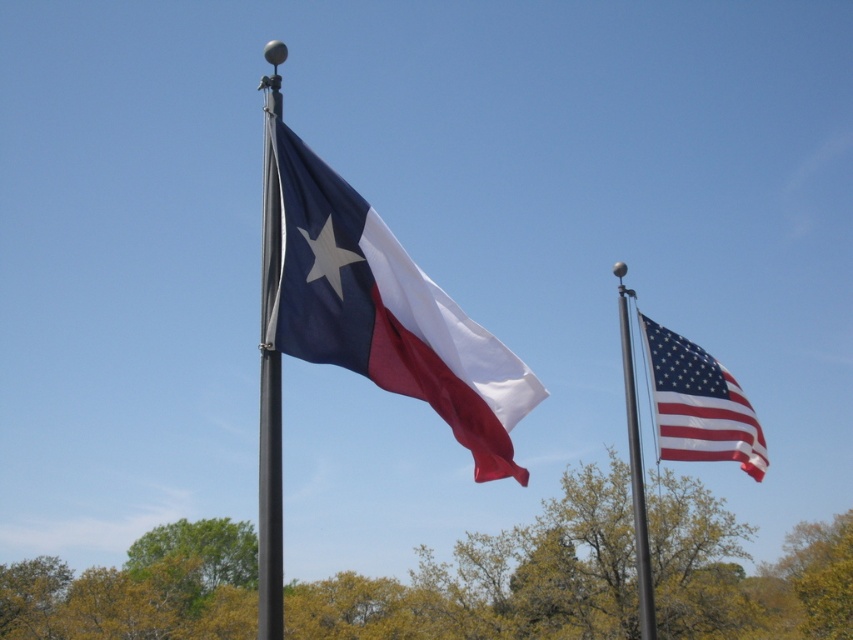
Question: Which of the following is the closest to the observer?

Choices:
 (A) (637, 576)
 (B) (283, 193)
 (C) (683, 364)

Answer: (B)

Question: In this image, where is american flag at right located relative to metallic pole at right?

Choices:
 (A) above
 (B) below

Answer: (A)

Question: Which point is closer to the camera?

Choices:
 (A) (643, 564)
 (B) (480, 451)
 (C) (757, 432)

Answer: (B)

Question: Where is american flag at right located in relation to metallic pole at right in the image?

Choices:
 (A) above
 (B) below

Answer: (A)

Question: Based on their relative distances, which object is farther from the american flag at right?

Choices:
 (A) matte polyester flag at center
 (B) metallic pole at right

Answer: (A)

Question: Does matte polyester flag at center have a larger size compared to metallic pole at right?

Choices:
 (A) no
 (B) yes

Answer: (A)